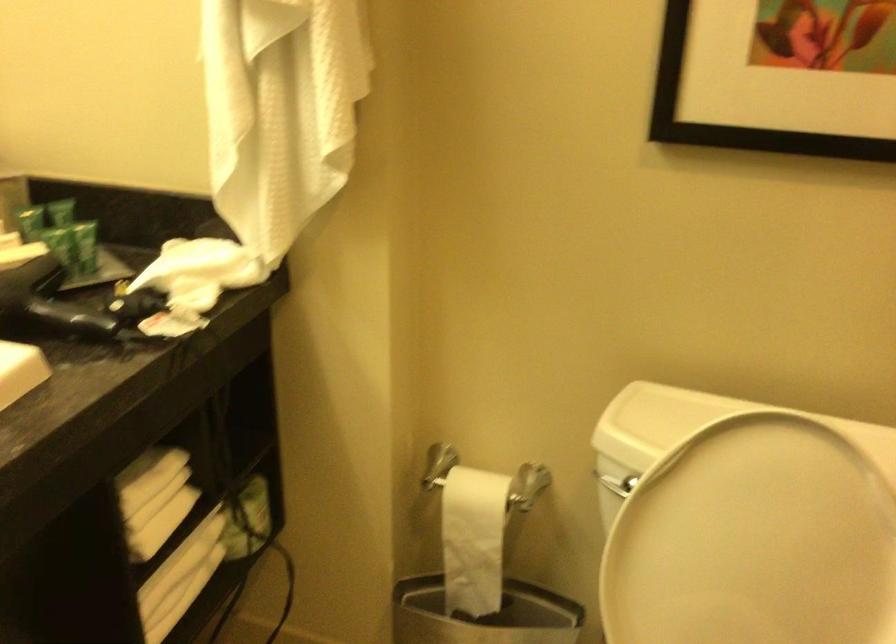
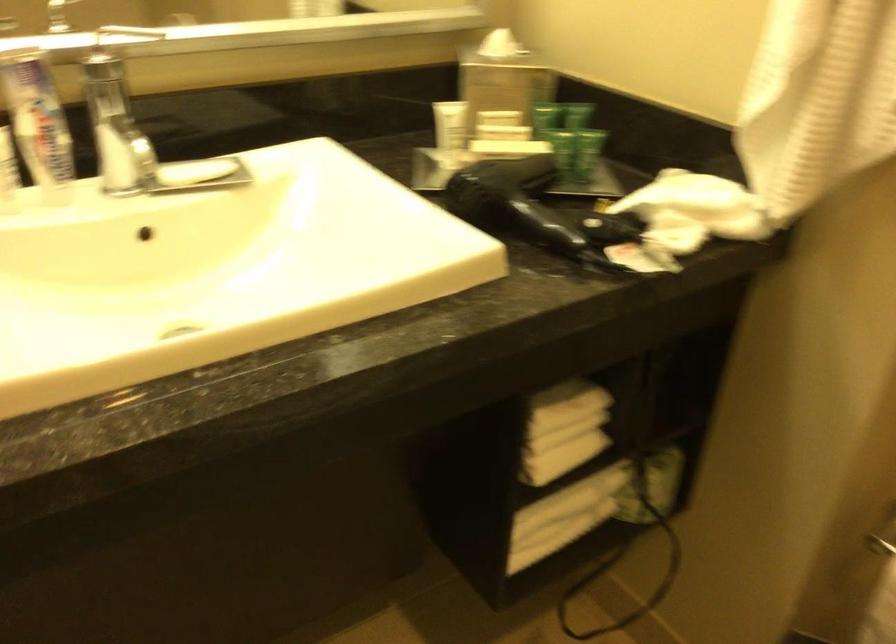
Locate, in the second image, the point that corresponds to pixel 201 272 in the first image.

(694, 211)